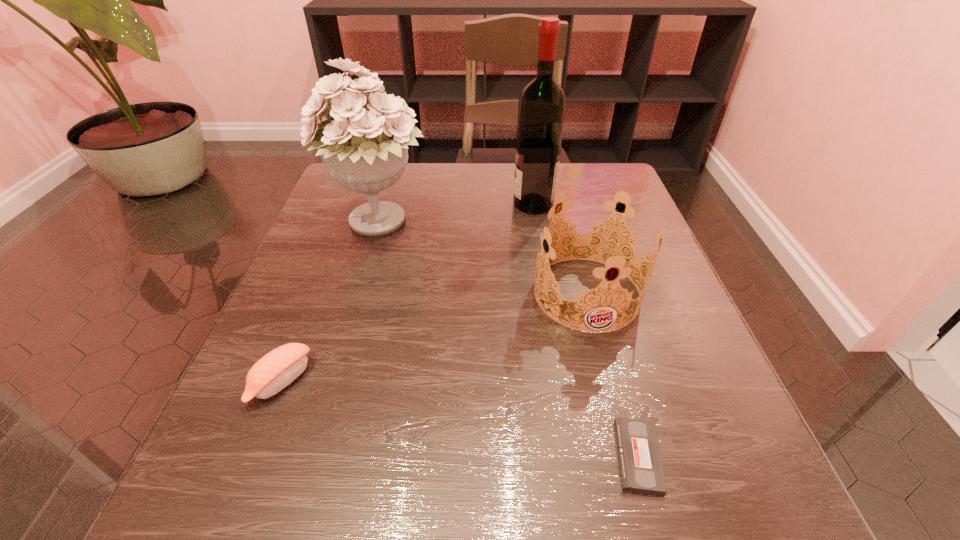
You are a GUI agent. You are given a task and a screenshot of the screen. Output one action in this format:
    pyautogui.click(x=<x>, y=<y>)
    Task: Click on the blank space located on the front and back of the alcohol
    Image resolution: width=960 pixels, height=540 pixels.
    Given the screenshot: What is the action you would take?
    pyautogui.click(x=452, y=204)

Locate an element on the screen. This screenshot has width=960, height=540. vacant area situated 0.060m on the right of the bouquet is located at coordinates (x=460, y=224).

What are the coordinates of `free space located 0.250m on the front of the third tallest object` in the screenshot? It's located at (636, 488).

This screenshot has height=540, width=960. I want to click on vacant point located 0.150m on the back of the second nearest object, so click(x=318, y=289).

Find the location of a particular element. free space located on the back of the videotape is located at coordinates (596, 303).

Where is `alcohol at the far edge`? The width and height of the screenshot is (960, 540). alcohol at the far edge is located at coordinates (541, 111).

The height and width of the screenshot is (540, 960). In order to click on bouquet located in the far edge section of the desktop in this screenshot , I will do `click(364, 150)`.

Locate an element on the screen. The width and height of the screenshot is (960, 540). object at the near edge is located at coordinates (x=641, y=471).

This screenshot has width=960, height=540. In order to click on bouquet that is positioned at the left edge in this screenshot , I will do coord(364,150).

This screenshot has width=960, height=540. I want to click on sushi that is at the left edge, so click(277, 369).